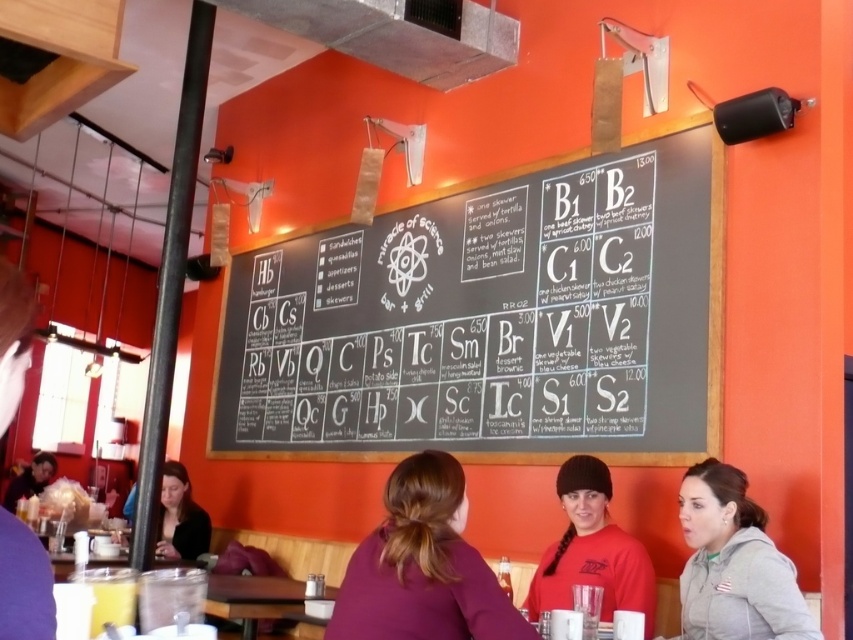
You are a customer standing in the restaurant and want to touch both the purple fabric hair at center and the red matte shirt at center. Can you reach both items without moving your position?

The distance between the purple fabric hair at center and the red matte shirt at center is 1.12 meters, so if you can extend your arms far enough to cover that distance, you might be able to touch both items without moving your position. However, this would depend on your personal reach capability.

You are a customer entering the restaurant and see the matte black shirt at lower left and the matte black jacket at lower left. You want to grab a coat from the one that is closer to the entrance. Which one should you choose?

The matte black shirt at lower left is 2.80 meters away from the matte black jacket at lower left. Since both are at the lower left, their distance from the entrance isn

You are a customer at the restaurant and want to order a dish that matches the color of the widest item between the purple fabric hair at center and the red matte shirt at center. Which color should you choose?

The purple fabric hair at center is wider than the red matte shirt at center, so you should choose a dish that matches the purple color.